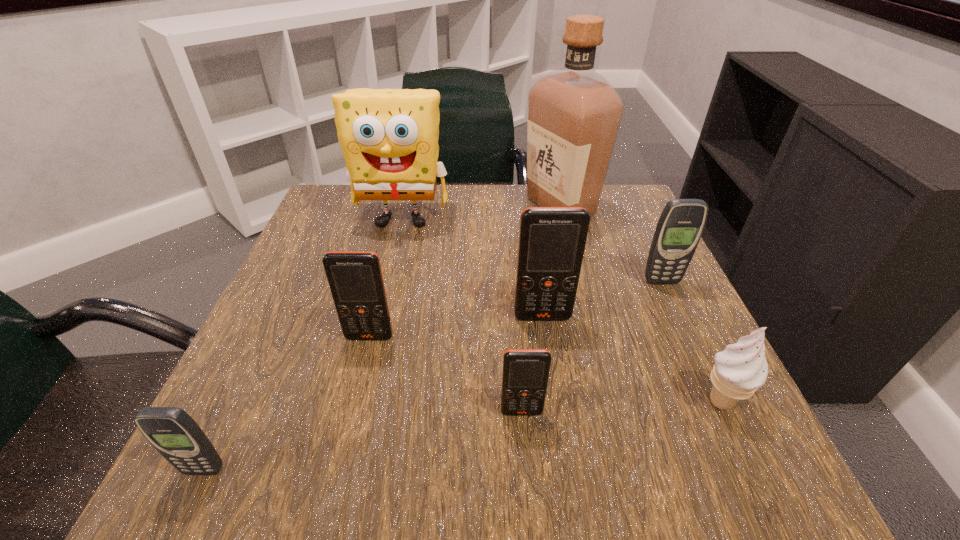
This screenshot has height=540, width=960. Identify the location of brown liquor. (574, 113).

In order to click on liquor in this screenshot , I will do `click(574, 113)`.

I want to click on yellow sponge, so click(389, 137).

Where is `sponge`? This screenshot has height=540, width=960. sponge is located at coordinates (389, 137).

What are the coordinates of `the biggest orange cellular telephone` in the screenshot? It's located at (552, 240).

Find the location of a particular element. Image resolution: width=960 pixels, height=540 pixels. the fourth nearest cellular telephone is located at coordinates (552, 240).

This screenshot has height=540, width=960. Find the location of `the sixth nearest object`. the sixth nearest object is located at coordinates (679, 229).

Locate an element on the screen. the farthest cellular telephone is located at coordinates (679, 229).

Where is `the fifth farthest object`? The image size is (960, 540). the fifth farthest object is located at coordinates (355, 278).

Image resolution: width=960 pixels, height=540 pixels. I want to click on the second cellular telephone from left to right, so click(x=355, y=278).